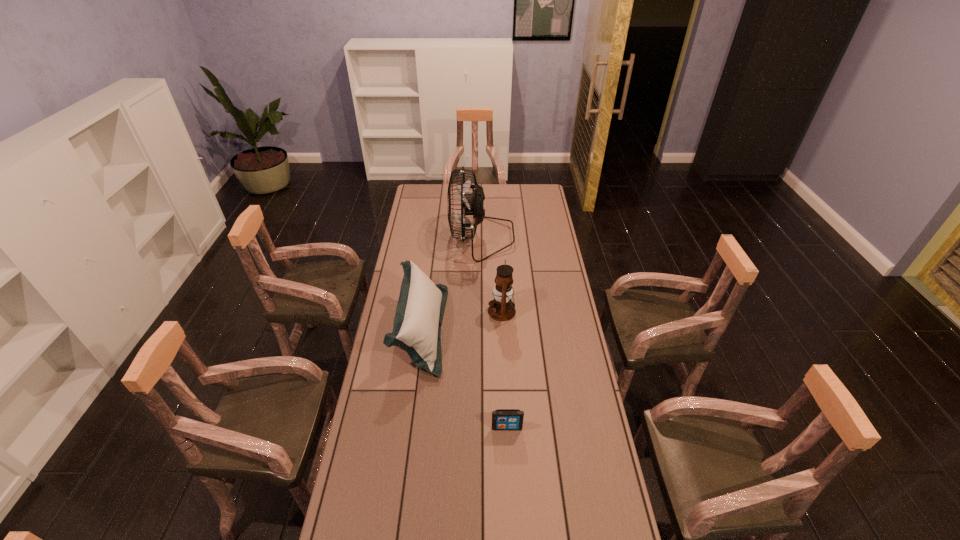
Locate an element on the screen. the farthest object is located at coordinates (473, 204).

In order to click on the tallest object in this screenshot , I will do `click(473, 204)`.

Where is `the third shortest object`? the third shortest object is located at coordinates (501, 308).

Where is `the second shortest object`? This screenshot has width=960, height=540. the second shortest object is located at coordinates (420, 309).

In order to click on the shortest object in this screenshot , I will do `click(502, 419)`.

This screenshot has height=540, width=960. Find the location of `the nearest object`. the nearest object is located at coordinates (502, 419).

You are a GUI agent. You are given a task and a screenshot of the screen. Output one action in this format:
    pyautogui.click(x=<x>, y=<y>)
    Task: Click on the vacant space situated in front of the tallest object, directing airflow
    This screenshot has width=960, height=540.
    Given the screenshot: What is the action you would take?
    pyautogui.click(x=407, y=238)

Image resolution: width=960 pixels, height=540 pixels. I want to click on vacant area located 0.190m in front of the tallest object, directing airflow, so pyautogui.click(x=415, y=238).

This screenshot has width=960, height=540. I want to click on vacant space located 0.250m in front of the tallest object, directing airflow, so coord(403,238).

Where is `vacant space located 0.350m on the side of the lantern, there is a wick adjustment knob`? The width and height of the screenshot is (960, 540). vacant space located 0.350m on the side of the lantern, there is a wick adjustment knob is located at coordinates (408, 311).